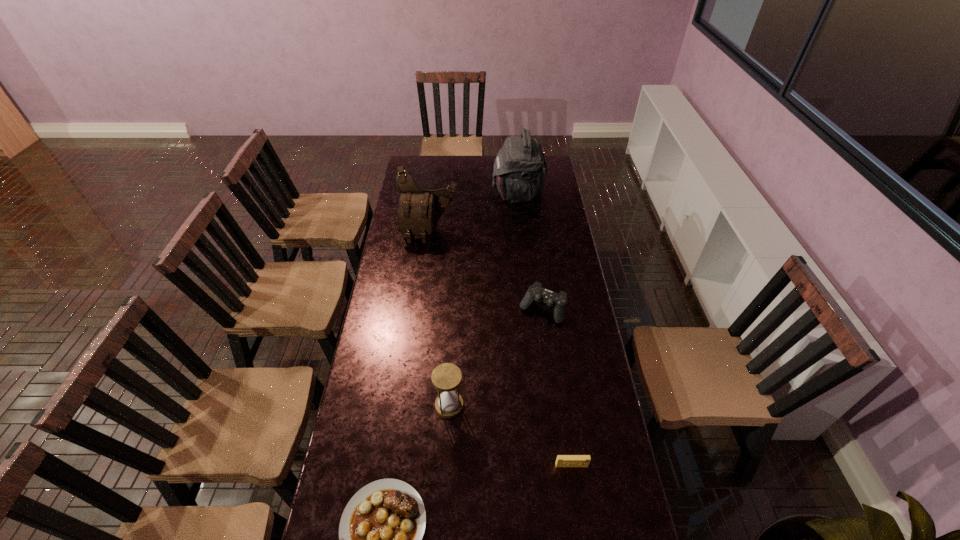
Identify the location of the farthest object. (520, 168).

Where is `the farther shoulder bag`? the farther shoulder bag is located at coordinates (520, 168).

Identify the location of the nearer shoulder bag. The width and height of the screenshot is (960, 540). (418, 212).

Identify the location of the fifth nearest object. (418, 212).

Locate an element on the screen. The height and width of the screenshot is (540, 960). the fourth farthest object is located at coordinates (446, 377).

Where is `hourglass`? Image resolution: width=960 pixels, height=540 pixels. hourglass is located at coordinates (446, 377).

Locate an element on the screen. Image resolution: width=960 pixels, height=540 pixels. control is located at coordinates (536, 293).

You are a GUI agent. You are given a task and a screenshot of the screen. Output one action in this format:
    pyautogui.click(x=<x>, y=<y>)
    Task: Click on the fourth tallest object
    
    Given the screenshot: What is the action you would take?
    pyautogui.click(x=536, y=293)

I want to click on videotape, so click(562, 460).

Find the location of a particular element. the second shortest object is located at coordinates (562, 460).